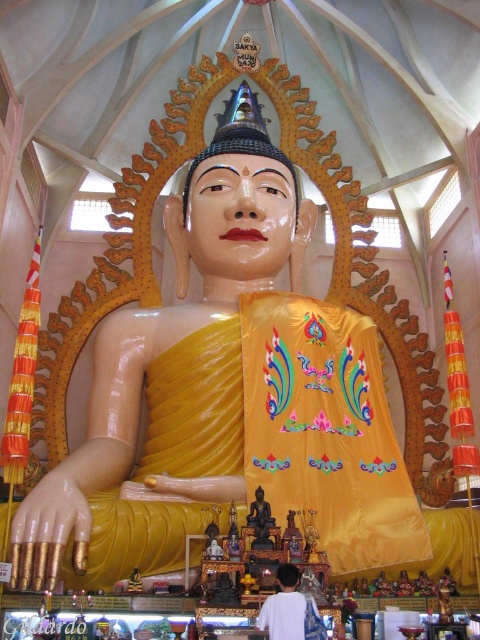
You are an art conservator examining two statues in a temple. You have a measuring tape that can only measure up to 1 meter. The statues are the matte gold statue at center and the black glossy statue at center. If you want to determine which one is wider, what should you do?

Since the matte gold statue at center might be wider than black glossy statue at center, you should use the measuring tape to measure the width of both statues and compare them to see which one exceeds the other in width.

You are a visitor standing in front of the statue and notice the white fabric at lower center and the black glossy statue at center. Which object is taller?

The white fabric at lower center has a lesser height compared to the black glossy statue at center, so the black glossy statue at center is taller.